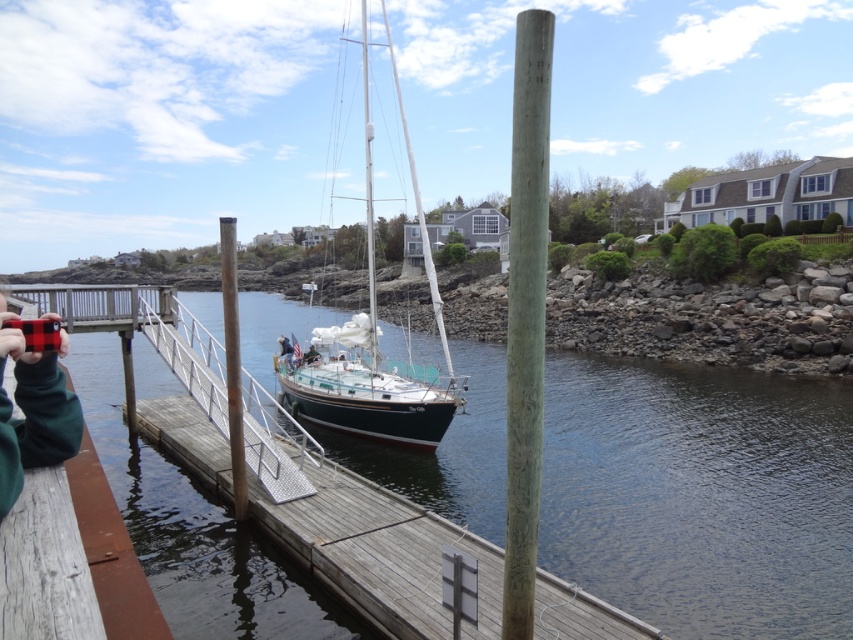
You are standing on the wooden pier and see the smooth dark water at center and the red plaid fabric at lower left. Which object is positioned to the left of the other?

The smooth dark water at center is to the left of the red plaid fabric at lower left.

You are standing on the wooden pier and want to know which object is taller between the shiny dark blue sailboat at center and the rustic wood post at center. Can you tell me which one is taller?

The shiny dark blue sailboat at center is taller than the rustic wood post at center according to the description.

You are standing on the wooden pier and want to take a photo of the shiny dark blue sailboat at center. However, there is a rustic wood post at center in the way. Can you move to the left or right to avoid the post while still keeping the sailboat in the frame?

The rustic wood post at center is behind the shiny dark blue sailboat at center, so moving left or right might allow you to position the sailboat in front of the post, keeping it in the frame while avoiding obstruction.